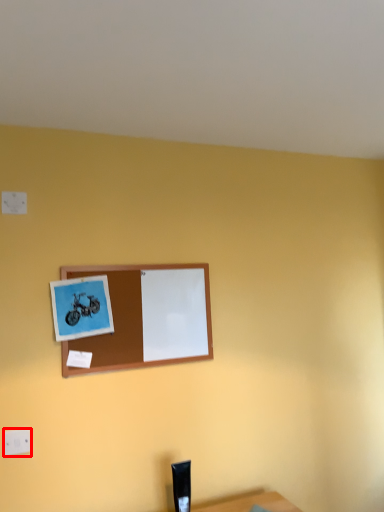
Question: In this image, where is electric outlet (annotated by the red box) located relative to picture frame?

Choices:
 (A) left
 (B) right

Answer: (A)